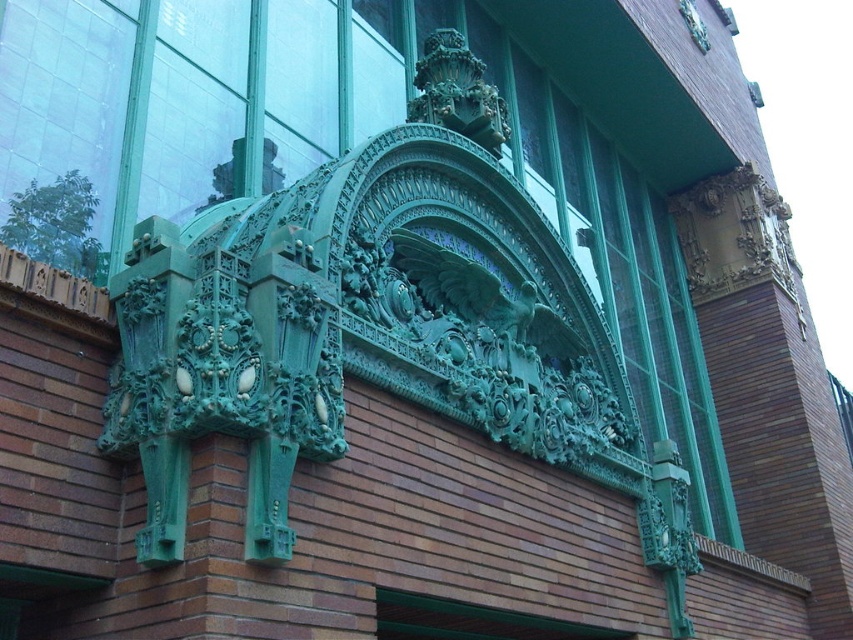
In the scene shown: You are an architect examining the building facade. You notice a specific point at coordinates [483,298]. What architectural element is located at that point?

The architectural element at point [483,298] is the green patina eagle at center.

You are standing at the base of the building and want to take a photo of the green patina eagle at center. If your camera can focus on objects up to 35 meters away, will you be able to capture a clear image of the eagle?

The green patina eagle at center is 37.47 meters from the viewer, which is beyond the camera focus limit of 35 meters. Therefore, the camera cannot capture a clear image of the eagle.

You are an architect examining the building facade. You notice two green patina elements at the center of the facade. Which one is closer to you, the green patina eagle at center or the green patina ornament at center?

The green patina eagle at center is closer to you because it is in front of the green patina ornament at center.